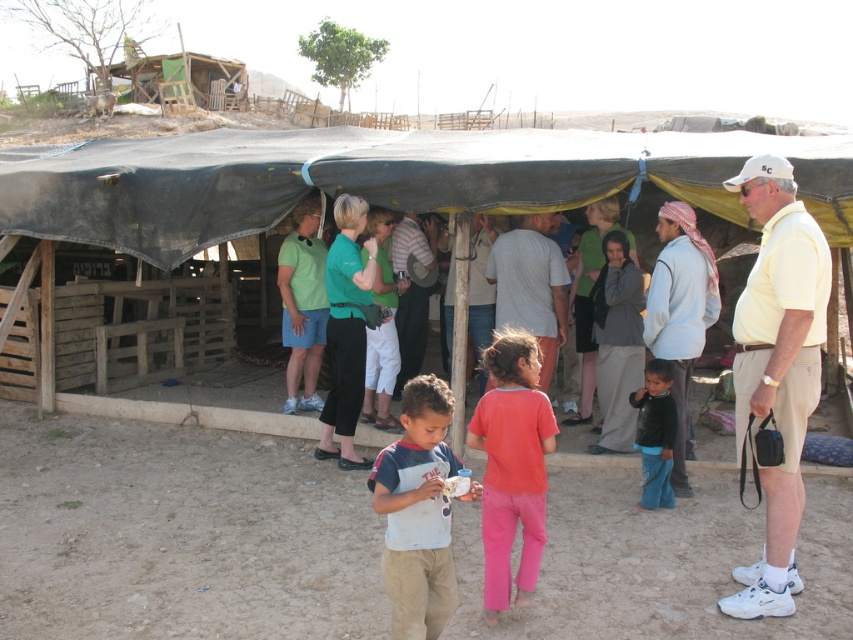
Question: Is black tarpaulin tent at center above matte pink pants at center?

Choices:
 (A) no
 (B) yes

Answer: (B)

Question: Is light brown cotton shirt at center above gray cotton shirt at center?

Choices:
 (A) yes
 (B) no

Answer: (B)

Question: Which point appears closest to the camera in this image?

Choices:
 (A) (488, 257)
 (B) (656, 440)

Answer: (B)

Question: Can you confirm if matte pink pants at center is positioned to the left of light blue cotton shirt at center?

Choices:
 (A) yes
 (B) no

Answer: (A)

Question: Which object is farther from the camera taking this photo?

Choices:
 (A) light blue cotton shirt at center
 (B) yellow cotton shirt at right

Answer: (A)

Question: Which point is closer to the camera taking this photo?

Choices:
 (A) (647, 417)
 (B) (45, 156)
 (C) (790, 440)

Answer: (C)